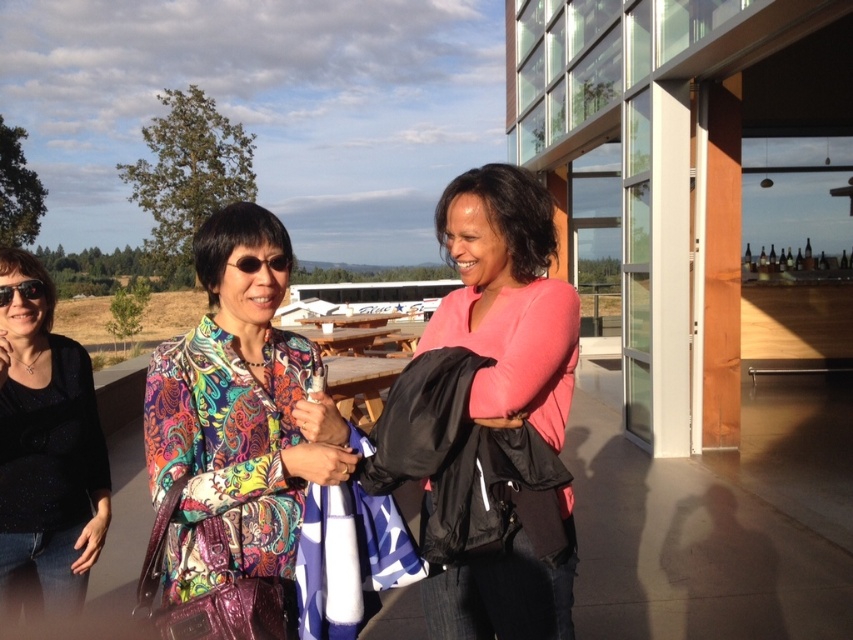
Question: Is pink matte jacket at center positioned in front of sparkly black top at center?

Choices:
 (A) no
 (B) yes

Answer: (B)

Question: Which point is closer to the camera?

Choices:
 (A) (67, 452)
 (B) (506, 637)
 (C) (277, 260)
 (D) (38, 282)

Answer: (C)

Question: Which point is closer to the camera taking this photo?

Choices:
 (A) (21, 253)
 (B) (242, 268)

Answer: (B)

Question: Which point is farther from the camera taking this photo?

Choices:
 (A) (305, 374)
 (B) (247, 268)
 (C) (26, 531)
 (D) (38, 291)

Answer: (D)

Question: Does pink matte jacket at center have a larger size compared to matte black sunglasses at center?

Choices:
 (A) yes
 (B) no

Answer: (A)

Question: Is sparkly black top at center thinner than matte black sunglasses at center?

Choices:
 (A) yes
 (B) no

Answer: (B)